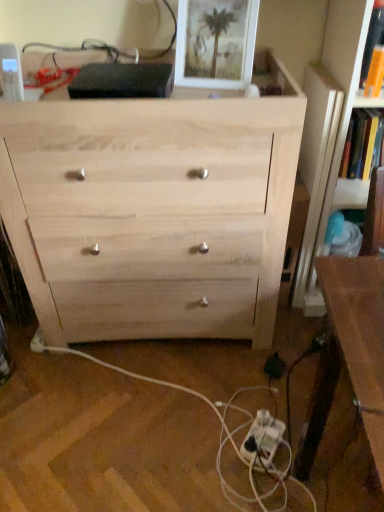
Where is `vacant area on the back side of black plastic electric outlet at lower right`? Image resolution: width=384 pixels, height=512 pixels. vacant area on the back side of black plastic electric outlet at lower right is located at coordinates (279, 342).